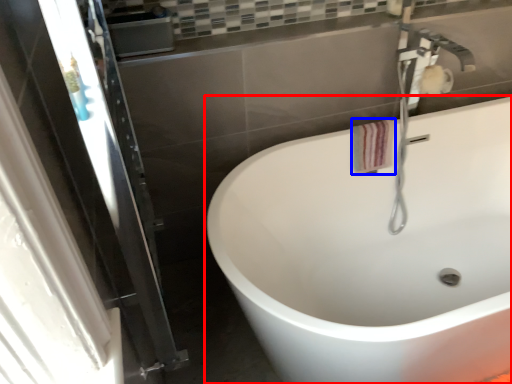
Question: Among these objects, which one is farthest to the camera, bathtub (highlighted by a red box) or hand towel (highlighted by a blue box)?

Choices:
 (A) bathtub
 (B) hand towel

Answer: (B)